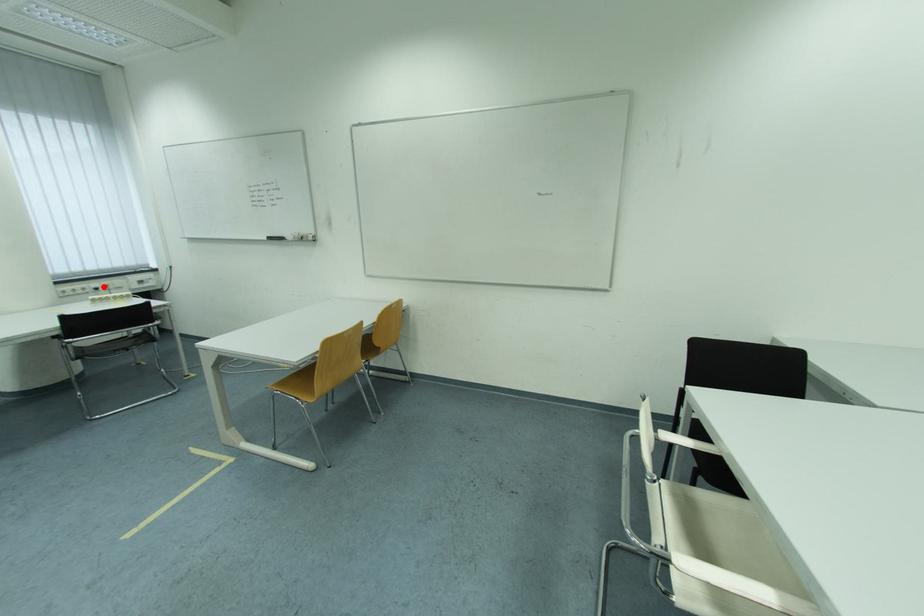
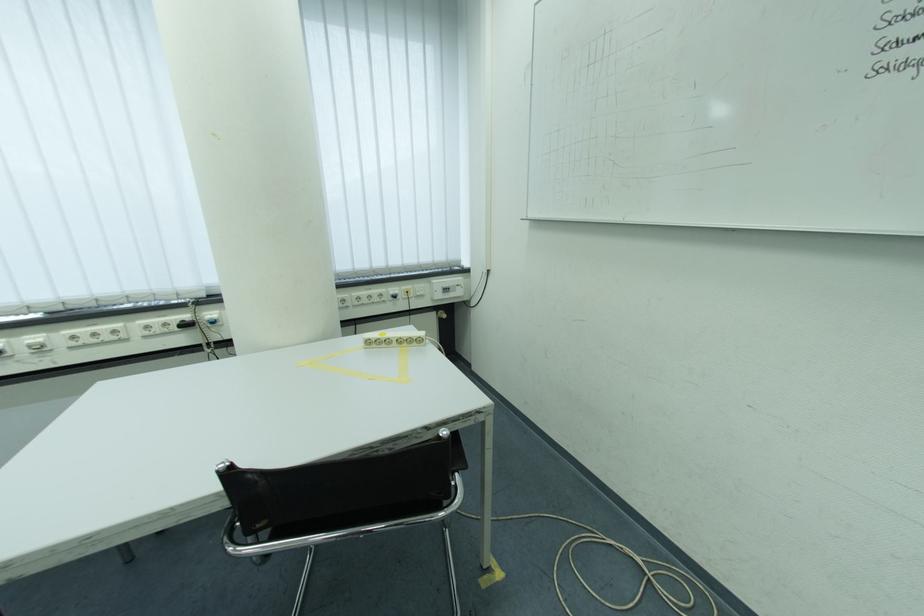
Where in the second image is the point corresponding to the highlighted location from the first image?

(402, 291)